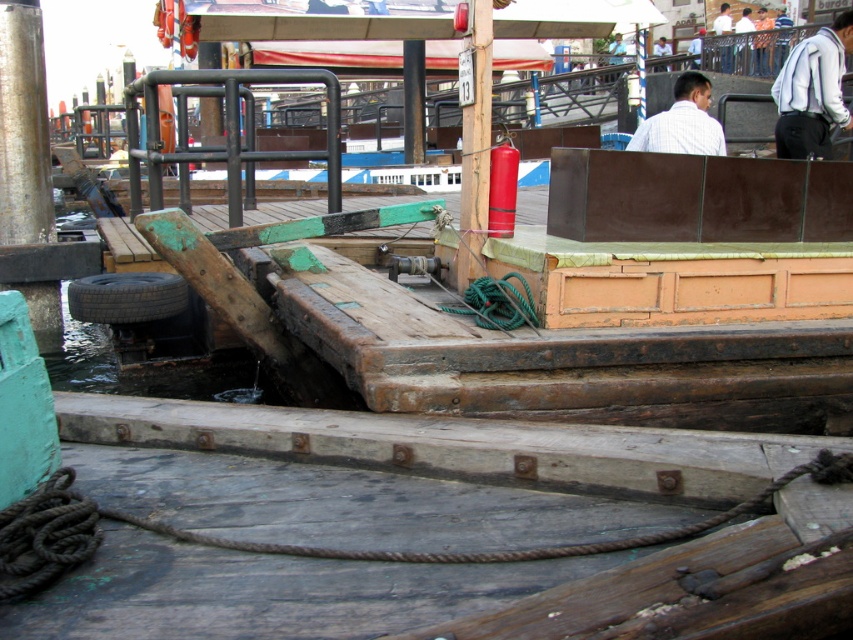
Which is below, white fabric shirt at upper right or black rubber tire at lower left?

black rubber tire at lower left is lower down.

Which is in front, point (804, 154) or point (184, 296)?

Point (184, 296) is in front.

Where is `white fabric shirt at upper right`? The image size is (853, 640). white fabric shirt at upper right is located at coordinates (811, 92).

Is black rubber tire at lower left in front of white shirt at upper center?

No.

Based on the photo, is black rubber tire at lower left shorter than white shirt at upper center?

No, black rubber tire at lower left is not shorter than white shirt at upper center.

Between point (158, 278) and point (706, 145), which one is positioned in front?

Point (706, 145) is more forward.

Where is `black rubber tire at lower left`? The image size is (853, 640). black rubber tire at lower left is located at coordinates (126, 296).

Who is positioned more to the left, white fabric shirt at upper right or white shirt at upper center?

white shirt at upper center

Is point (833, 49) closer to camera compared to point (699, 129)?

No, it is not.

The image size is (853, 640). Find the location of `white fabric shirt at upper right`. white fabric shirt at upper right is located at coordinates (811, 92).